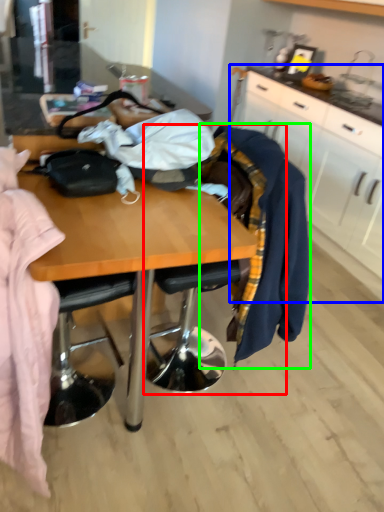
Question: Considering the real-world distances, which object is closest to chair (highlighted by a red box)? cabinetry (highlighted by a blue box) or clothing (highlighted by a green box).

Choices:
 (A) cabinetry
 (B) clothing

Answer: (B)